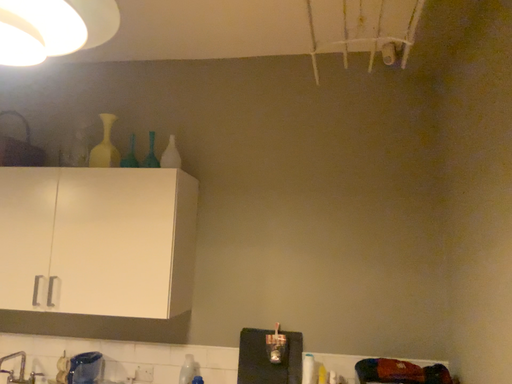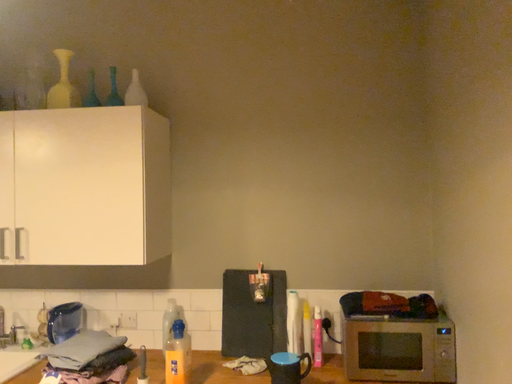
Question: Which way did the camera rotate in the video?

Choices:
 (A) rotated downward
 (B) rotated upward

Answer: (A)